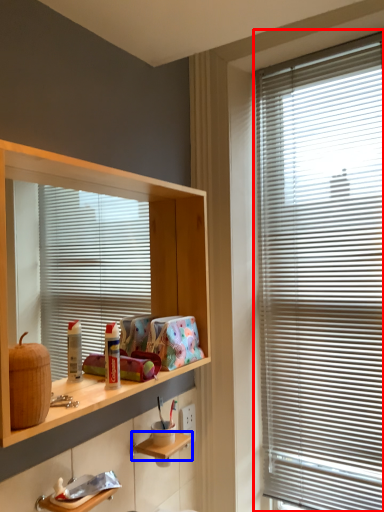
Question: Among these objects, which one is farthest to the camera, window blind (highlighted by a red box) or shelf (highlighted by a blue box)?

Choices:
 (A) window blind
 (B) shelf

Answer: (A)